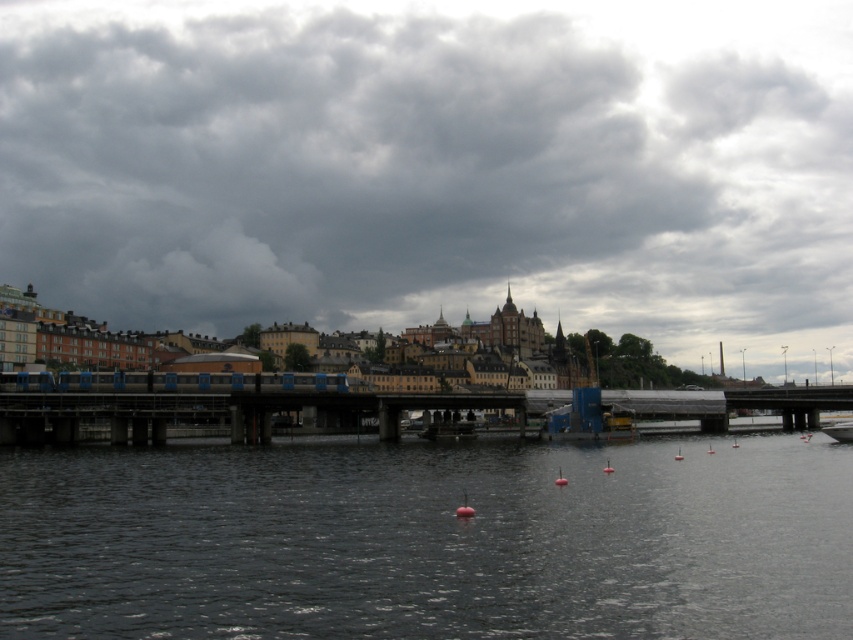
You are a drone operator who needs to fly a drone from the metallic gray bridge at center to the dark gray cloud at upper center. Given that the drone has a maximum range of 200 meters, will it be able to reach the cloud?

The distance between the dark gray cloud at upper center and the metallic gray bridge at center is 207.55 meters, which exceeds the drone operator drone maximum range of 200 meters. Therefore, the drone will not be able to reach the dark gray cloud at upper center.

You are standing at the waterfront and want to reach the point marked at coordinates point (373, 547). If your maximum walking distance is 30 meters, will you be able to reach it?

The distance between you and point (373, 547) is 35.21 meters, which exceeds your maximum walking distance of 30 meters. Therefore, you cannot reach it.

You are a photographer standing at the waterfront and want to capture both the point at coordinates point [772,280] and point [167,381] in your shot. Which point will appear closer to the edge of your camera frame?

Point [167,381] will appear closer to the edge of your camera frame because it is closer to the camera than point [772,280], which is further away.